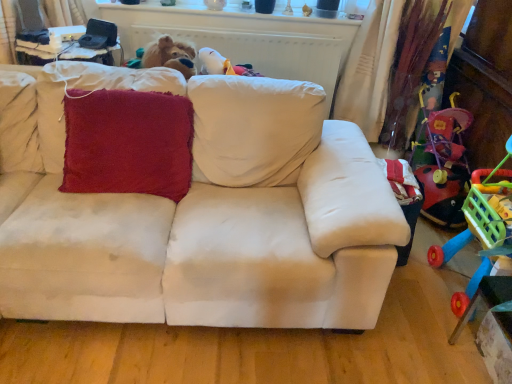
Question: Is point (465, 196) closer or farther from the camera than point (271, 155)?

Choices:
 (A) farther
 (B) closer

Answer: (A)

Question: Looking at their shapes, would you say rubberized plastic shopping cart at right is wider or thinner than beige fabric couch at center?

Choices:
 (A) wide
 (B) thin

Answer: (B)

Question: Estimate the real-world distances between objects in this image. Which object is farther from the beige fabric couch at center?

Choices:
 (A) rubberized plastic shopping cart at right
 (B) velvety red cushion at center

Answer: (A)

Question: Which object is the farthest from the velvety red cushion at center?

Choices:
 (A) beige fabric couch at center
 (B) rubberized plastic shopping cart at right

Answer: (B)